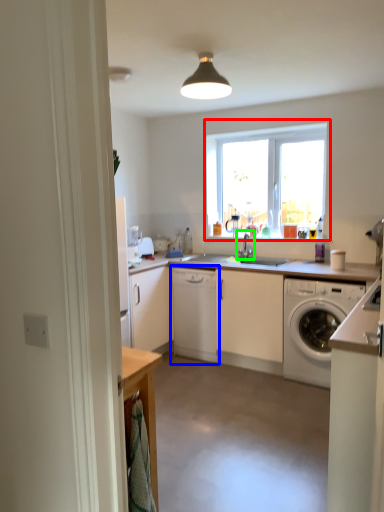
Question: Which is nearer to the window (highlighted by a red box)? cabinetry (highlighted by a blue box) or tap (highlighted by a green box).

Choices:
 (A) cabinetry
 (B) tap

Answer: (B)